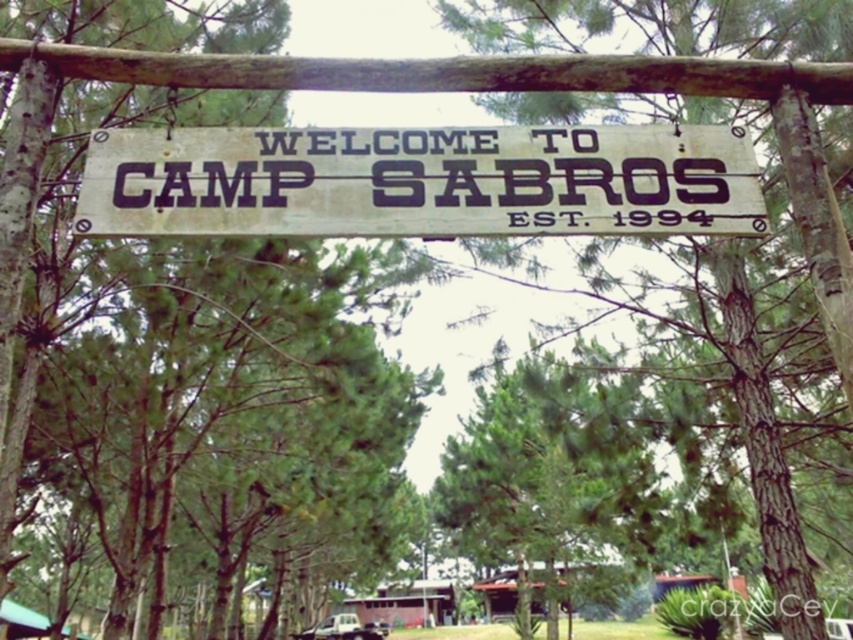
This screenshot has width=853, height=640. What do you see at coordinates (199, 356) in the screenshot? I see `green leafy tree at center` at bounding box center [199, 356].

I want to click on green leafy tree at center, so tap(199, 356).

Does rusty wood sign at center appear on the left side of brown rough bark tree at center?

Correct, you'll find rusty wood sign at center to the left of brown rough bark tree at center.

Does rusty wood sign at center have a larger size compared to brown rough bark tree at center?

Correct, rusty wood sign at center is larger in size than brown rough bark tree at center.

Image resolution: width=853 pixels, height=640 pixels. In order to click on rusty wood sign at center in this screenshot , I will do `click(421, 180)`.

Does green leafy tree at center have a smaller size compared to brown rough bark tree at center?

No, green leafy tree at center is not smaller than brown rough bark tree at center.

Between point (67, 86) and point (798, 132), which one is positioned in front?

Point (798, 132) is more forward.

Where is `green leafy tree at center`? The height and width of the screenshot is (640, 853). green leafy tree at center is located at coordinates coord(199,356).